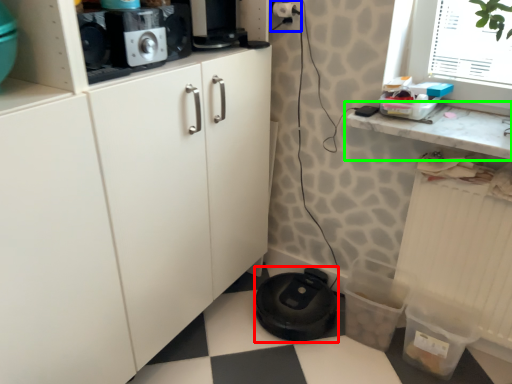
Question: Estimate the real-world distances between objects in this image. Which object is farther from appliance (highlighted by a red box), electric outlet (highlighted by a blue box) or countertop (highlighted by a green box)?

Choices:
 (A) electric outlet
 (B) countertop

Answer: (A)